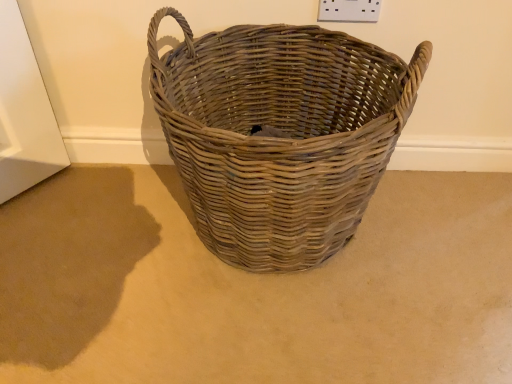
Question: Would you say natural wicker basket at center is inside or outside natural woven basket at center?

Choices:
 (A) outside
 (B) inside

Answer: (A)

Question: In terms of size, does natural wicker basket at center appear bigger or smaller than natural woven basket at center?

Choices:
 (A) small
 (B) big

Answer: (A)

Question: Is natural wicker basket at center in front of or behind natural woven basket at center in the image?

Choices:
 (A) behind
 (B) front

Answer: (A)

Question: From their relative heights in the image, would you say natural woven basket at center is taller or shorter than natural wicker basket at center?

Choices:
 (A) tall
 (B) short

Answer: (A)

Question: From the image's perspective, is natural woven basket at center located above or below natural wicker basket at center?

Choices:
 (A) above
 (B) below

Answer: (A)

Question: Do you think natural woven basket at center is within natural wicker basket at center, or outside of it?

Choices:
 (A) inside
 (B) outside

Answer: (B)

Question: Considering the positions of natural woven basket at center and natural wicker basket at center in the image, is natural woven basket at center wider or thinner than natural wicker basket at center?

Choices:
 (A) wide
 (B) thin

Answer: (B)